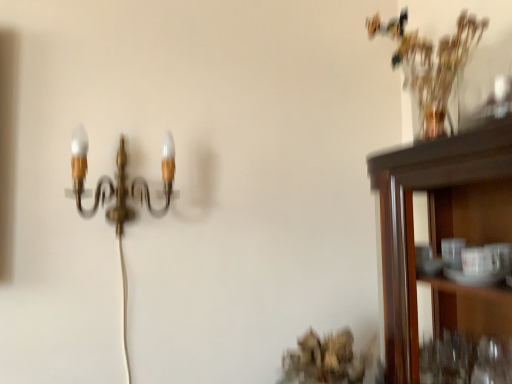
Locate an element on the screen. gold metallic wall sconce at upper left is located at coordinates (120, 181).

What do you see at coordinates (120, 181) in the screenshot? I see `gold metallic wall sconce at upper left` at bounding box center [120, 181].

The image size is (512, 384). What do you see at coordinates (435, 125) in the screenshot? I see `translucent glass vase at upper right` at bounding box center [435, 125].

Where is `translucent glass vase at upper right`? This screenshot has width=512, height=384. translucent glass vase at upper right is located at coordinates (435, 125).

At what (x,y) coordinates should I click in order to perform the action: click on gold metallic wall sconce at upper left. Please return your answer as a coordinate pair (x, y). Looking at the image, I should click on (120, 181).

Visually, is translucent glass vase at upper right positioned to the left or to the right of gold metallic wall sconce at upper left?

translucent glass vase at upper right is positioned on gold metallic wall sconce at upper left's right side.

Looking at this image, does translucent glass vase at upper right lie behind gold metallic wall sconce at upper left?

No, translucent glass vase at upper right is closer to the camera.

Which is less distant, (x=442, y=128) or (x=103, y=184)?

Point (x=442, y=128) is positioned closer to the camera compared to point (x=103, y=184).

From the image's perspective, which is above, translucent glass vase at upper right or gold metallic wall sconce at upper left?

translucent glass vase at upper right.

From a real-world perspective, relative to gold metallic wall sconce at upper left, is translucent glass vase at upper right vertically above or below?

From a real-world perspective, translucent glass vase at upper right is physically above gold metallic wall sconce at upper left.

Between translucent glass vase at upper right and gold metallic wall sconce at upper left, which one has smaller width?

translucent glass vase at upper right is thinner.

Who is shorter, translucent glass vase at upper right or gold metallic wall sconce at upper left?

With less height is translucent glass vase at upper right.

Looking at the image, does translucent glass vase at upper right seem bigger or smaller compared to gold metallic wall sconce at upper left?

translucent glass vase at upper right is smaller than gold metallic wall sconce at upper left.

Is translucent glass vase at upper right not within gold metallic wall sconce at upper left?

Yes, translucent glass vase at upper right is not within gold metallic wall sconce at upper left.

Is there a large distance between translucent glass vase at upper right and gold metallic wall sconce at upper left?

Actually, translucent glass vase at upper right and gold metallic wall sconce at upper left are a little close together.

Is translucent glass vase at upper right facing away from gold metallic wall sconce at upper left?

No, translucent glass vase at upper right's orientation is not away from gold metallic wall sconce at upper left.

The width and height of the screenshot is (512, 384). Identify the location of lamp that is on the left side of translucent glass vase at upper right. (120, 181).

Is gold metallic wall sconce at upper left at the right side of translucent glass vase at upper right?

In fact, gold metallic wall sconce at upper left is to the left of translucent glass vase at upper right.

Does gold metallic wall sconce at upper left lie in front of translucent glass vase at upper right?

No, it is behind translucent glass vase at upper right.

Is point (76, 203) positioned behind point (435, 120)?

Yes, point (76, 203) is farther from viewer.

From the image's perspective, between gold metallic wall sconce at upper left and translucent glass vase at upper right, which one is located above?

translucent glass vase at upper right appears higher in the image.

From a real-world perspective, who is located higher, gold metallic wall sconce at upper left or translucent glass vase at upper right?

In real-world perspective, translucent glass vase at upper right is above.

Considering the sizes of objects gold metallic wall sconce at upper left and translucent glass vase at upper right in the image provided, who is thinner, gold metallic wall sconce at upper left or translucent glass vase at upper right?

translucent glass vase at upper right is thinner.

Between gold metallic wall sconce at upper left and translucent glass vase at upper right, which one has less height?

translucent glass vase at upper right.

Considering the relative sizes of gold metallic wall sconce at upper left and translucent glass vase at upper right in the image provided, is gold metallic wall sconce at upper left bigger than translucent glass vase at upper right?

Yes, gold metallic wall sconce at upper left is bigger than translucent glass vase at upper right.

Looking at this image, choose the correct answer: Is gold metallic wall sconce at upper left inside translucent glass vase at upper right or outside it?

gold metallic wall sconce at upper left is not inside translucent glass vase at upper right, it's outside.

Is the surface of gold metallic wall sconce at upper left in direct contact with translucent glass vase at upper right?

There is a gap between gold metallic wall sconce at upper left and translucent glass vase at upper right.

Is gold metallic wall sconce at upper left turned away from translucent glass vase at upper right?

That's not correct — gold metallic wall sconce at upper left is not looking away from translucent glass vase at upper right.

Identify the location of vase in front of the gold metallic wall sconce at upper left. The image size is (512, 384). (435, 125).

Locate an element on the screen. The height and width of the screenshot is (384, 512). lamp behind the translucent glass vase at upper right is located at coordinates (120, 181).

This screenshot has height=384, width=512. I want to click on vase in front of the gold metallic wall sconce at upper left, so click(435, 125).